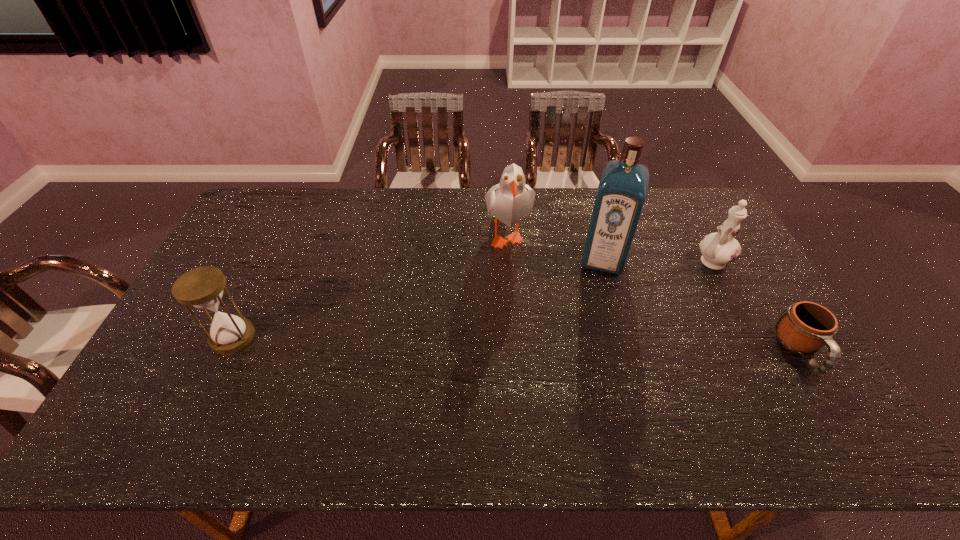
Find the location of a particular element. The width and height of the screenshot is (960, 540). vacant space on the desktop that is between the leftmost object and the shortest object and is positioned at the spout of the chinaware is located at coordinates (587, 346).

I want to click on vacant spot on the desktop that is between the leftmost object and the shortest object and is positioned on the flat label side of the third object from left to right, so click(585, 346).

The image size is (960, 540). In order to click on vacant spot on the desktop that is between the hourglass and the shortest object and is positioned at the beak of the gull in this screenshot , I will do `click(433, 342)`.